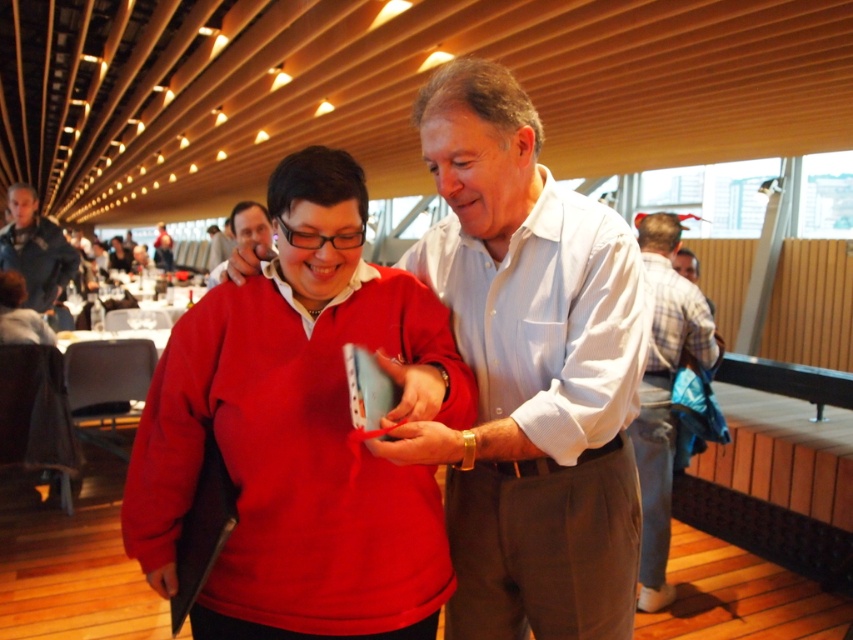
You are a photographer standing in the center of the room and want to take a photo of the matte black glasses at center and the matte black jacket at center. Which object will appear closer to the bottom of the photo?

The matte black glasses at center is positioned under the matte black jacket at center, so it will appear closer to the bottom of the photo.

You are a photographer standing in the restaurant and want to take a picture of the matte red sweater at center and the matte black glasses at center. Which object should you focus on first if you want to capture both in the frame without moving the camera?

The matte black glasses at center is to the left of the matte red sweater at center, so you should focus on the matte black glasses at center first to ensure both objects are in the frame without moving the camera.